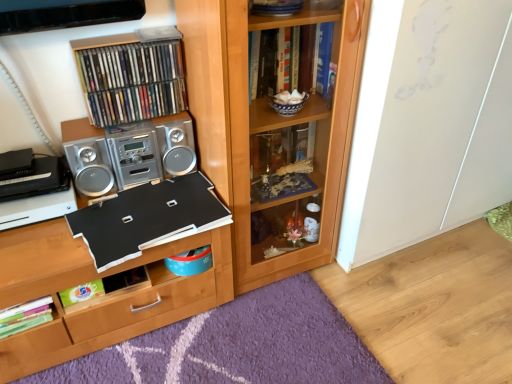
Identify the location of free space above metallic cd case at upper left, arranged as the 1th book when viewed from the top (from a real-world perspective). The height and width of the screenshot is (384, 512). (122, 36).